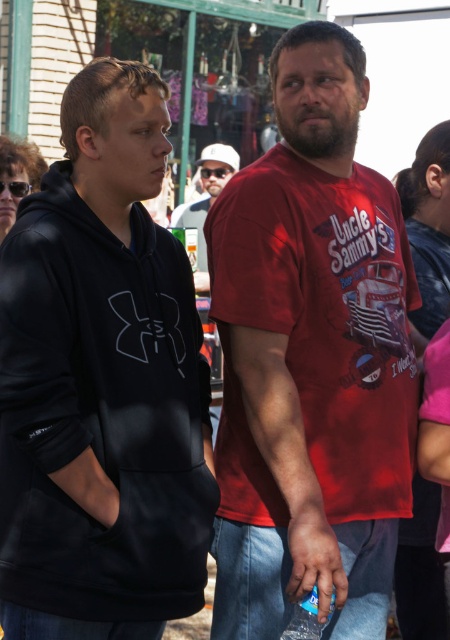
You are organizing a photo shoot and need to place a small prop between the black fleece hoodie at left and the matte white cap at center. Based on their sizes, which object should the prop be placed closer to?

The black fleece hoodie at left is wider than the matte white cap at center, so the prop should be placed closer to the matte white cap at center to maintain balance between the two objects.